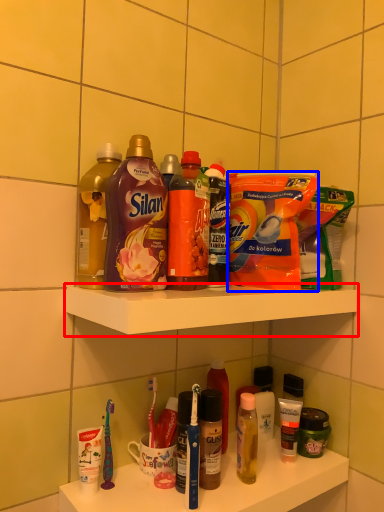
Question: Which object appears closest to the camera in this image, shelf (highlighted by a red box) or cleaning product (highlighted by a blue box)?

Choices:
 (A) shelf
 (B) cleaning product

Answer: (A)